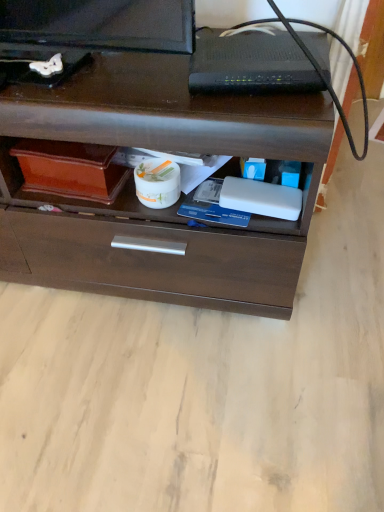
This screenshot has height=512, width=384. In order to click on free space in front of brown wood chest of drawers at center in this screenshot , I will do `click(140, 394)`.